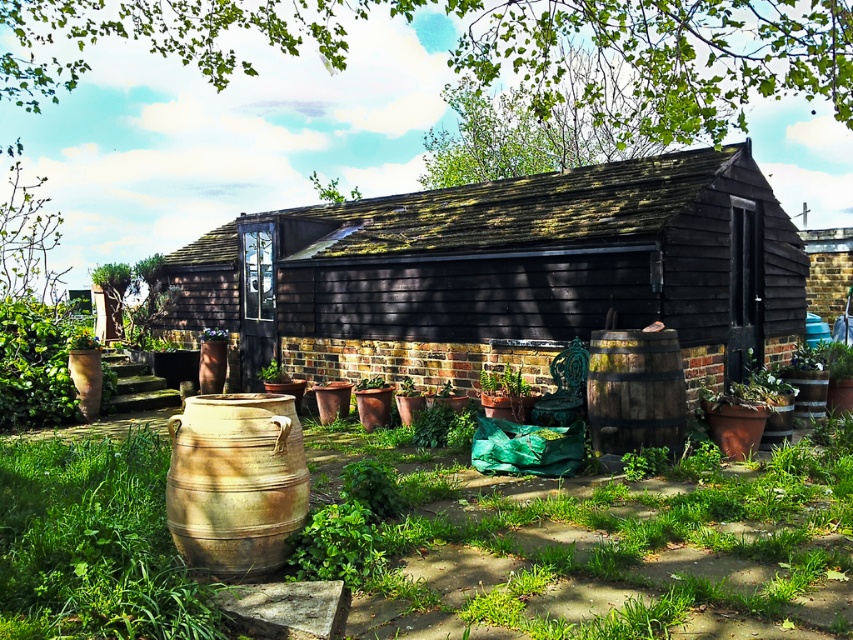
Consider the image. Is black wooden hut at center further to camera compared to earthy clay barrel at center?

Yes, it is.

Find the location of a particular element. black wooden hut at center is located at coordinates (503, 273).

You are a GUI agent. You are given a task and a screenshot of the screen. Output one action in this format:
    pyautogui.click(x=<x>, y=<y>)
    Task: Click on the black wooden hut at center
    The image size is (853, 640).
    Given the screenshot: What is the action you would take?
    pyautogui.click(x=503, y=273)

Measure the distance between earthy clay barrel at center and green matte plant at center.

A distance of 5.27 meters exists between earthy clay barrel at center and green matte plant at center.

Does point (247, 502) come farther from viewer compared to point (277, 380)?

No.

Consider the image. Who is more forward, [171,451] or [274,371]?

Point [171,451] is more forward.

Where is `earthy clay barrel at center`? The image size is (853, 640). earthy clay barrel at center is located at coordinates (235, 481).

Is brown wooden barrel at center-right taller than green matte plant at center?

Yes, brown wooden barrel at center-right is taller than green matte plant at center.

Looking at this image, is brown wooden barrel at center-right thinner than green matte plant at center?

In fact, brown wooden barrel at center-right might be wider than green matte plant at center.

Where is `brown wooden barrel at center-right`? This screenshot has width=853, height=640. brown wooden barrel at center-right is located at coordinates (635, 390).

Image resolution: width=853 pixels, height=640 pixels. I want to click on brown wooden barrel at center-right, so click(635, 390).